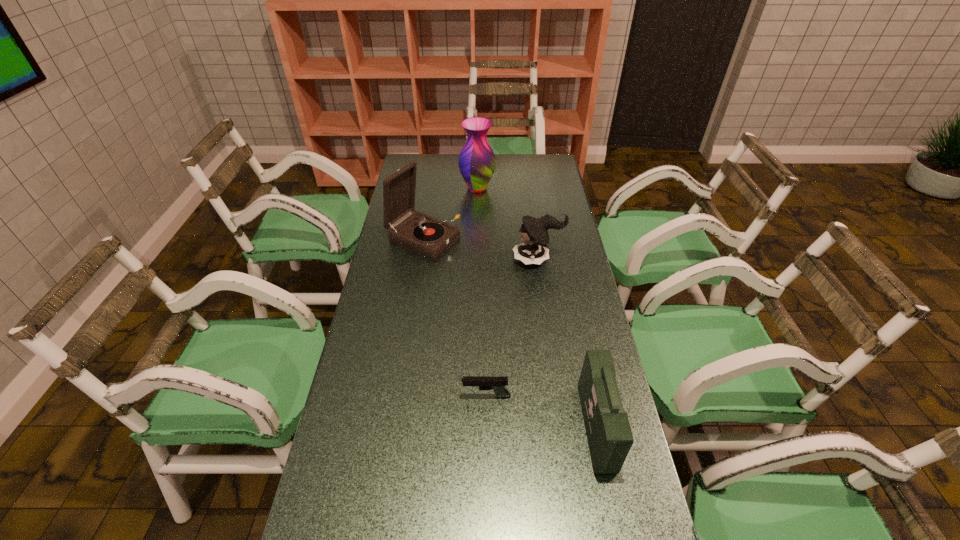
What are the coordinates of `vacant space located 0.050m on the front-facing side of the first-aid kit` in the screenshot? It's located at (565, 427).

Locate an element on the screen. The width and height of the screenshot is (960, 540). vacant space located on the front-facing side of the first-aid kit is located at coordinates (465, 427).

At what (x,y) coordinates should I click in order to perform the action: click on vacant region located on the front-facing side of the first-aid kit. Please return your answer as a coordinate pair (x, y). The image size is (960, 540). Looking at the image, I should click on (542, 427).

Identify the location of vacant space located 0.110m on the front-facing side of the pistol. The height and width of the screenshot is (540, 960). (421, 396).

Locate an element on the screen. This screenshot has width=960, height=540. free space located 0.220m on the front-facing side of the pistol is located at coordinates click(x=381, y=396).

Identify the location of vacant region located on the front-facing side of the pistol. (371, 396).

The image size is (960, 540). Identify the location of object that is at the far edge. (477, 162).

Where is `object present at the left edge`? object present at the left edge is located at coordinates (424, 235).

Image resolution: width=960 pixels, height=540 pixels. I want to click on doll present at the right edge, so click(534, 250).

Locate an element on the screen. the first-aid kit located in the right edge section of the desktop is located at coordinates pos(609,435).